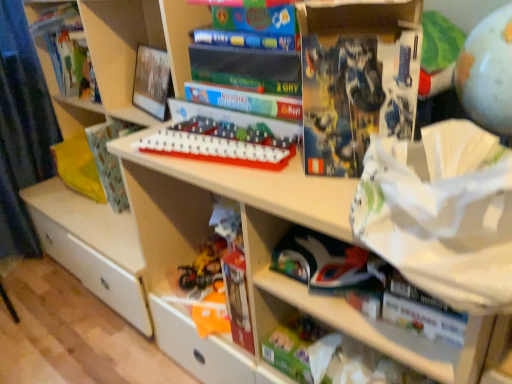
Question: Does green matte toy at lower center, placed as the 3th toy when sorted from front to back, have a smaller size compared to shiny plastic toys at lower center, the 4th toy from the front?

Choices:
 (A) no
 (B) yes

Answer: (A)

Question: Is green matte toy at lower center, acting as the first toy starting from the bottom, further to the viewer compared to shiny plastic toys at lower center, the 4th toy from the front?

Choices:
 (A) no
 (B) yes

Answer: (A)

Question: From the image's perspective, is green matte toy at lower center, acting as the first toy starting from the bottom, below shiny plastic toys at lower center, the first toy in the left-to-right sequence?

Choices:
 (A) yes
 (B) no

Answer: (A)

Question: Can you confirm if green matte toy at lower center, the second toy viewed from the right, is wider than shiny plastic toys at lower center, placed as the 2th toy when sorted from bottom to top?

Choices:
 (A) no
 (B) yes

Answer: (A)

Question: Considering the relative sizes of green matte toy at lower center, placed as the 4th toy when sorted from top to bottom, and shiny plastic toys at lower center, the 4th toy viewed from the right, in the image provided, is green matte toy at lower center, placed as the 4th toy when sorted from top to bottom, bigger than shiny plastic toys at lower center, the 4th toy viewed from the right,?

Choices:
 (A) no
 (B) yes

Answer: (B)

Question: Considering the positions of patterned paper at left, marked as the 2th paperback book in a right-to-left arrangement, and white plastic game board at center, the second toy in the front-to-back sequence, in the image, is patterned paper at left, marked as the 2th paperback book in a right-to-left arrangement, taller or shorter than white plastic game board at center, the second toy in the front-to-back sequence,?

Choices:
 (A) short
 (B) tall

Answer: (B)

Question: From a real-world perspective, is patterned paper at left, which is the 2th paperback book from front to back, positioned above or below white plastic game board at center, marked as the 3th toy in a right-to-left arrangement?

Choices:
 (A) below
 (B) above

Answer: (A)

Question: Considering the positions of patterned paper at left, the 1th paperback book positioned from the back, and white plastic game board at center, marked as the 3th toy in a right-to-left arrangement, in the image, is patterned paper at left, the 1th paperback book positioned from the back, bigger or smaller than white plastic game board at center, marked as the 3th toy in a right-to-left arrangement,?

Choices:
 (A) small
 (B) big

Answer: (B)

Question: Does point (117, 132) appear closer or farther from the camera than point (217, 134)?

Choices:
 (A) farther
 (B) closer

Answer: (A)

Question: From a real-world perspective, is patterned paper at left, the 1th paperback book positioned from the back, physically located above or below hardcover book at upper left?

Choices:
 (A) above
 (B) below

Answer: (B)

Question: Relative to hardcover book at upper left, is patterned paper at left, marked as the 2th paperback book in a right-to-left arrangement, in front or behind?

Choices:
 (A) behind
 (B) front

Answer: (B)

Question: Is patterned paper at left, the 1th paperback book positioned from the back, spatially inside hardcover book at upper left, or outside of it?

Choices:
 (A) outside
 (B) inside

Answer: (A)

Question: From the image's perspective, is patterned paper at left, marked as the 2th paperback book in a right-to-left arrangement, positioned above or below hardcover book at upper left?

Choices:
 (A) above
 (B) below

Answer: (B)

Question: In terms of size, does blue matte book at upper center, which ranks as the first paperback book in right-to-left order, appear bigger or smaller than shiny plastic toys at lower center, the 4th toy from the front?

Choices:
 (A) big
 (B) small

Answer: (A)

Question: From a real-world perspective, is blue matte book at upper center, which ranks as the first paperback book in right-to-left order, physically located above or below shiny plastic toys at lower center, the first toy in the left-to-right sequence?

Choices:
 (A) above
 (B) below

Answer: (A)